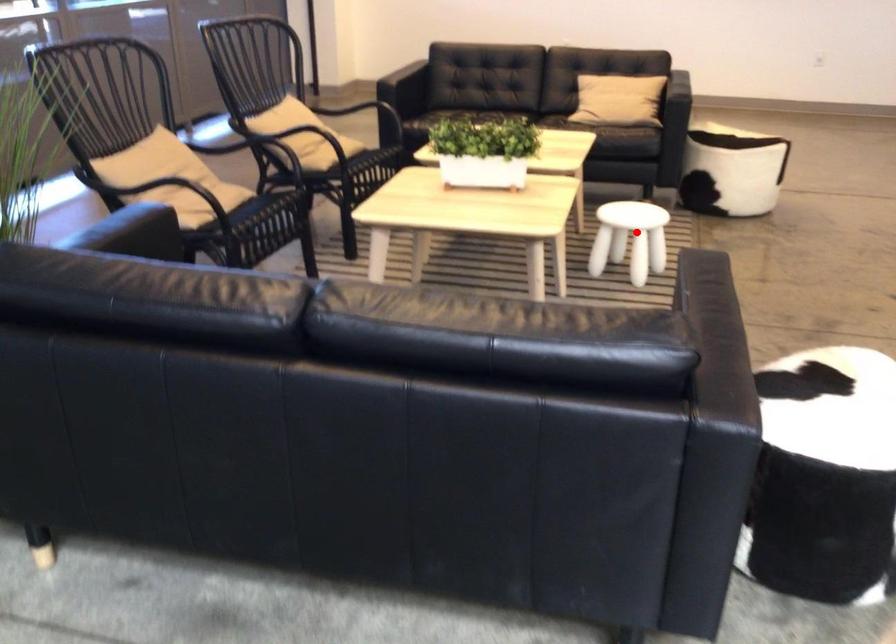
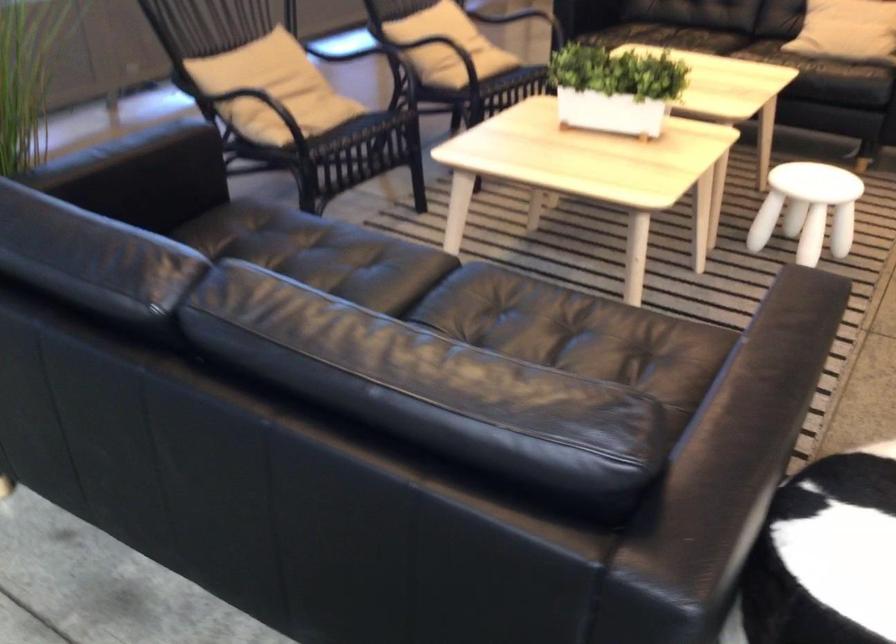
Question: I am providing you with two images of the same scene from different viewpoints. Given a red point in image1, look at the same physical point in image2. Is it:

Choices:
 (A) Closer to the viewpoint
 (B) Farther from the viewpoint

Answer: (A)